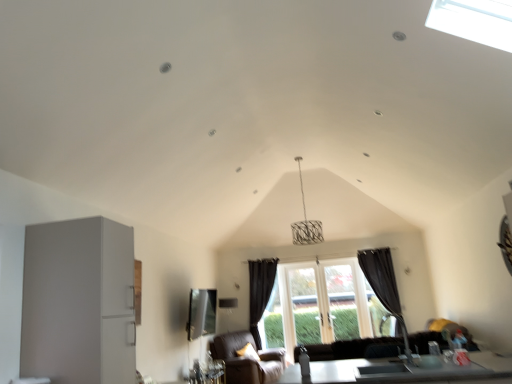
Question: Considering their positions, is transparent glass window at center located in front of or behind black fabric curtain at right, placed as the second curtain when sorted from left to right?

Choices:
 (A) behind
 (B) front

Answer: (A)

Question: From a real-world perspective, relative to black fabric curtain at right, placed as the second curtain when sorted from left to right, is transparent glass window at center vertically above or below?

Choices:
 (A) below
 (B) above

Answer: (A)

Question: Which of these objects is positioned closest to the metallic silver table at lower right?

Choices:
 (A) brown leather armchair at lower center
 (B) matte white refrigerator at left
 (C) black fabric curtain at right, placed as the second curtain when sorted from left to right
 (D) matte glass window screen at center
 (E) transparent glass window at center

Answer: (B)

Question: Estimate the real-world distances between objects in this image. Which object is closer to the matte white refrigerator at left?

Choices:
 (A) transparent glass window at center
 (B) brown leather armchair at lower center
 (C) black fabric curtain at center, which is counted as the first curtain, starting from the left
 (D) metallic silver table at lower right
 (E) black fabric curtain at right, placed as the 1th curtain when sorted from right to left

Answer: (D)